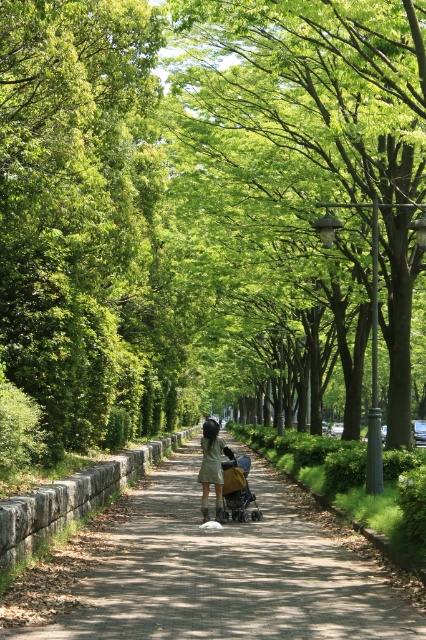
Can you confirm if green leafy tree at center is smaller than brown fabric baby carriage at center?

No.

At what (x,y) coordinates should I click in order to perform the action: click on green leafy tree at center. Please return your answer as a coordinate pair (x, y). This screenshot has width=426, height=640. Looking at the image, I should click on (301, 102).

Does green leafy tree at center appear over matte gray dress at center?

Yes.

Describe the element at coordinates (301, 102) in the screenshot. The image size is (426, 640). I see `green leafy tree at center` at that location.

This screenshot has width=426, height=640. Describe the element at coordinates (301, 102) in the screenshot. I see `green leafy tree at center` at that location.

The width and height of the screenshot is (426, 640). What are the coordinates of `green leafy tree at center` in the screenshot? It's located at (301, 102).

Can you confirm if matte gray dress at center is positioned to the left of brown fabric baby carriage at center?

Indeed, matte gray dress at center is positioned on the left side of brown fabric baby carriage at center.

Does point (221, 515) come closer to viewer compared to point (244, 509)?

Yes.

The height and width of the screenshot is (640, 426). What are the coordinates of `matte gray dress at center` in the screenshot? It's located at (212, 467).